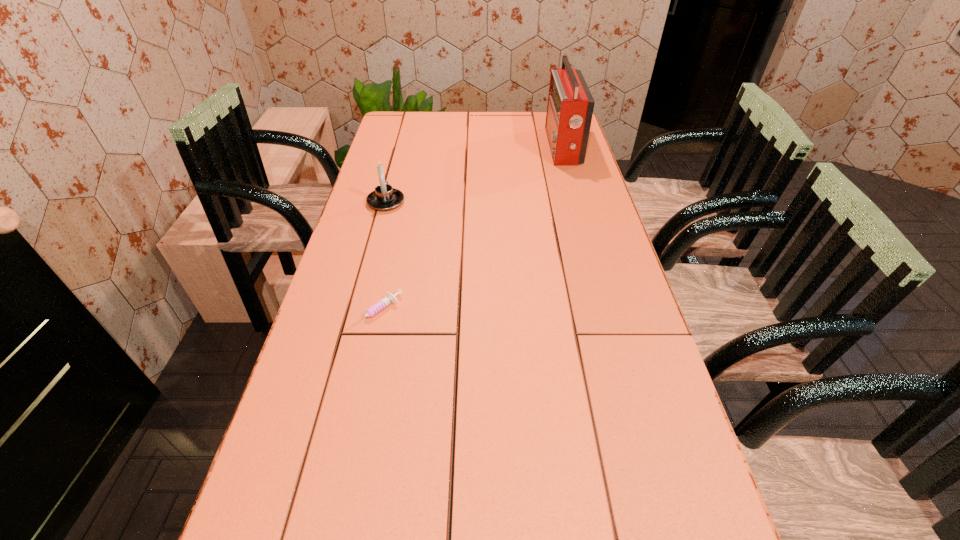
The height and width of the screenshot is (540, 960). In the image, there is a desktop. Find the location of `free space at the right edge`. free space at the right edge is located at coordinates (660, 481).

In the image, there is a desktop. Find the location of `free region at the far left corner`. free region at the far left corner is located at coordinates (414, 116).

Locate an element on the screen. The width and height of the screenshot is (960, 540). vacant space in between the tallest object and the syringe is located at coordinates (469, 230).

At what (x,y) coordinates should I click in order to perform the action: click on free space between the second nearest object and the radio receiver. Please return your answer as a coordinate pair (x, y). Looking at the image, I should click on (474, 174).

You are a GUI agent. You are given a task and a screenshot of the screen. Output one action in this format:
    pyautogui.click(x=<x>, y=<y>)
    Task: Click on the unoccupied area between the nearest object and the second tallest object
    This screenshot has width=960, height=540.
    Given the screenshot: What is the action you would take?
    pyautogui.click(x=381, y=258)

Where is `unoccupied area between the second tallest object and the radio receiver`? unoccupied area between the second tallest object and the radio receiver is located at coordinates (474, 174).

Identify the location of vacant area that lies between the syringe and the radio receiver. (469, 230).

I want to click on empty location between the radio receiver and the nearest object, so click(469, 230).

Locate an element on the screen. This screenshot has width=960, height=540. object that is the nearest to the second nearest object is located at coordinates (389, 299).

Identify the location of the second closest object to the tallest object. This screenshot has height=540, width=960. (389, 299).